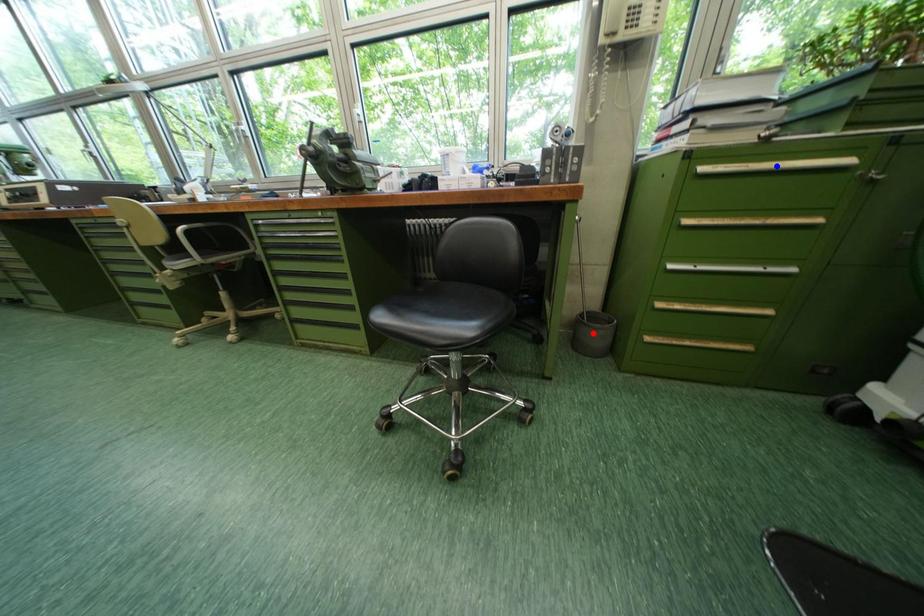
Question: In the image, two points are highlighted. Which point is nearer to the camera? Reply with the corresponding letter.

Choices:
 (A) blue point
 (B) red point

Answer: (A)